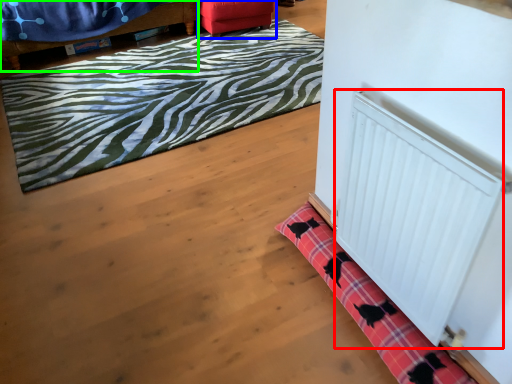
Question: Which is nearer to the radiator (highlighted by a red box)? furniture (highlighted by a blue box) or furniture (highlighted by a green box).

Choices:
 (A) furniture
 (B) furniture

Answer: (A)